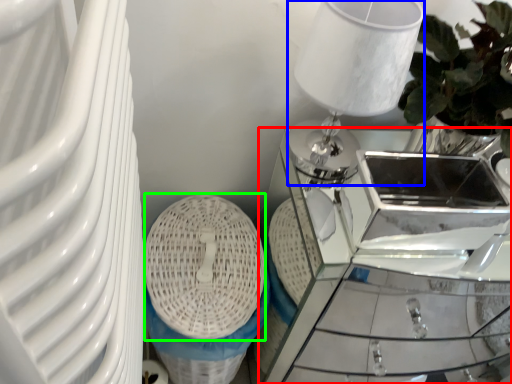
Question: Based on their relative distances, which object is farther from table (highlighted by a red box)? Choose from table lamp (highlighted by a blue box) and basket (highlighted by a green box).

Choices:
 (A) table lamp
 (B) basket

Answer: (A)